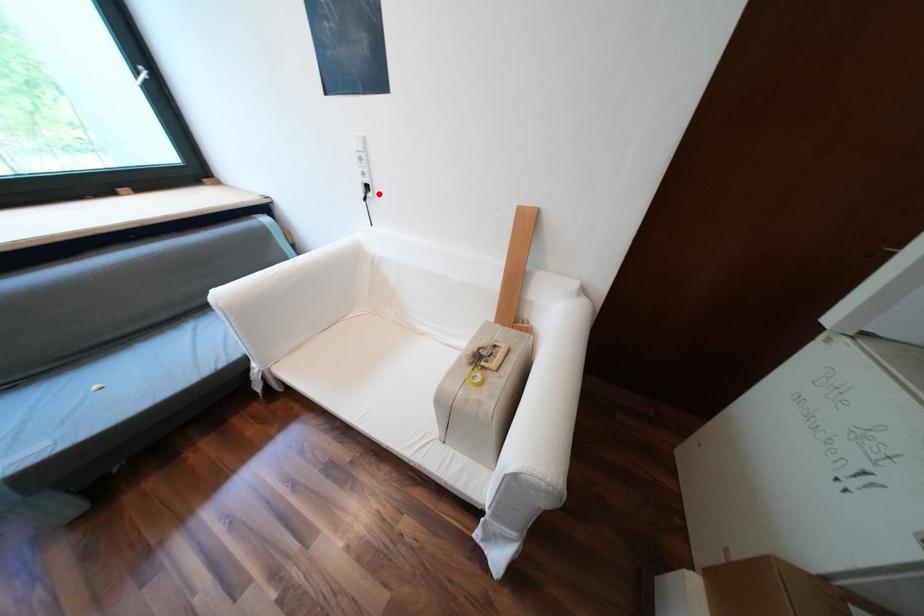
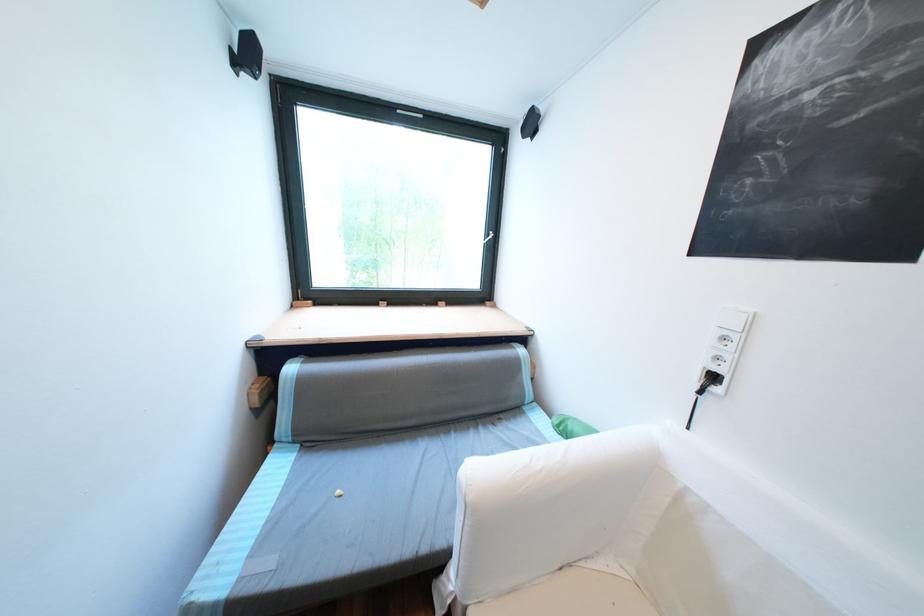
The point at the highlighted location is marked in the first image. Where is the corresponding point in the second image?

(725, 390)